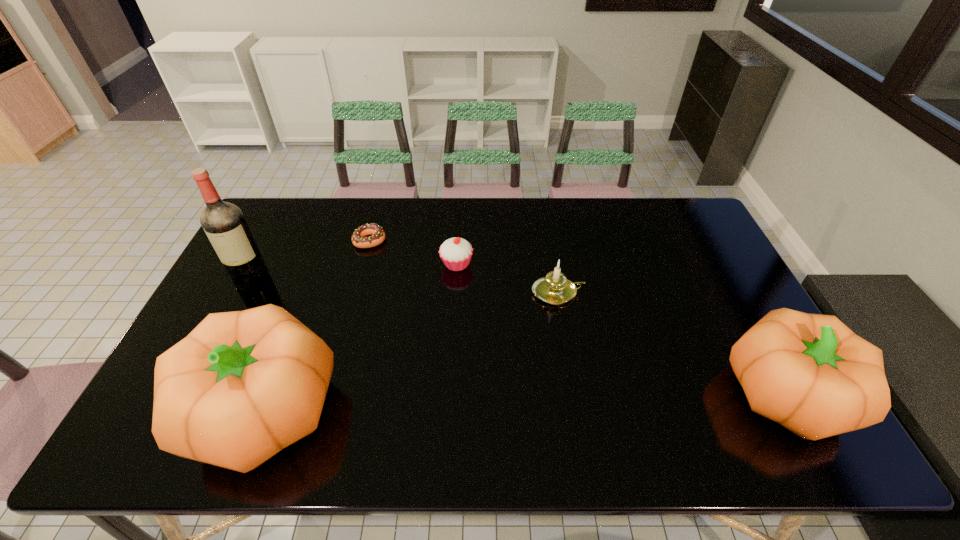
Find the location of a particular element. The width and height of the screenshot is (960, 540). free spot between the fourth shortest object and the candle holder is located at coordinates (673, 343).

Locate an element on the screen. vacant area that lies between the tallest object and the second object from right to left is located at coordinates (405, 287).

Find the location of a particular element. This screenshot has height=540, width=960. free space between the cupcake and the candle holder is located at coordinates (507, 278).

The height and width of the screenshot is (540, 960). Find the location of `free space between the third shortest object and the liquor`. free space between the third shortest object and the liquor is located at coordinates (405, 287).

Identify which object is the third nearest to the farthest object. Please provide its 2D coordinates. Your answer should be formatted as a tuple, i.e. [(x, y)], where the tuple contains the x and y coordinates of a point satisfying the conditions above.

[(243, 385)]

Select which object appears as the third closest to the left pumpkin. Please provide its 2D coordinates. Your answer should be formatted as a tuple, i.e. [(x, y)], where the tuple contains the x and y coordinates of a point satisfying the conditions above.

[(359, 240)]

Identify the location of free space that satisfies the following two spatial constraints: 1. on the front side of the farthest object; 2. on the carved face of the left pumpkin. The height and width of the screenshot is (540, 960). (324, 409).

Locate an element on the screen. This screenshot has width=960, height=540. free space that satisfies the following two spatial constraints: 1. on the front side of the farthest object; 2. on the carved face of the left pumpkin is located at coordinates (324, 409).